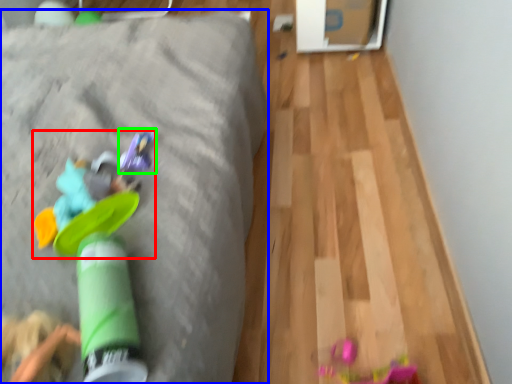
Question: Based on their relative distances, which object is farther from toy (highlighted by a red box)? Choose from furniture (highlighted by a blue box) and toy (highlighted by a green box).

Choices:
 (A) furniture
 (B) toy

Answer: (A)